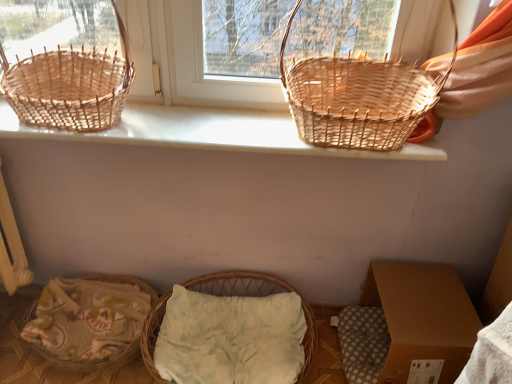
The width and height of the screenshot is (512, 384). In order to click on free location to the right of woven natural basket at left, which appears as the 1th picnic basket when viewed from the top in this screenshot , I will do `click(189, 122)`.